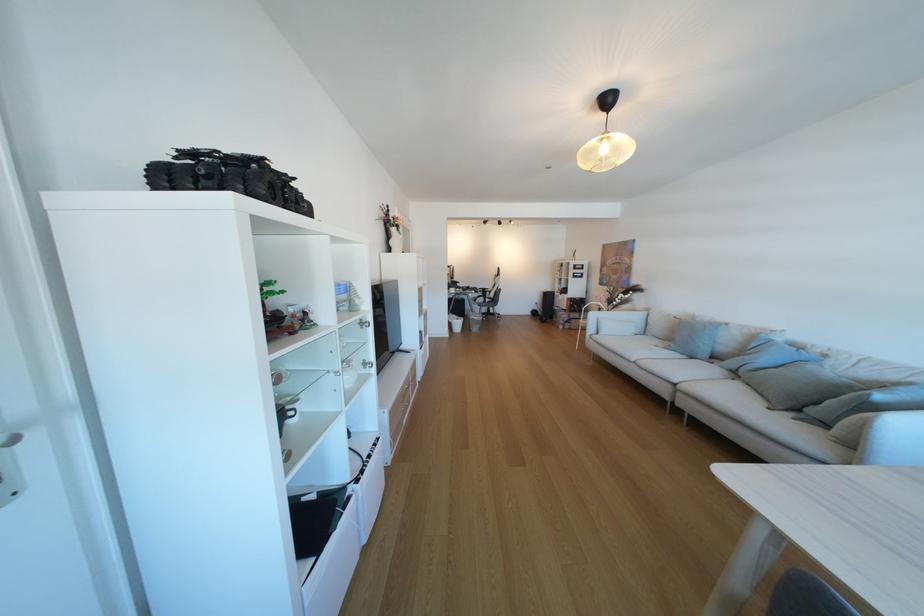
Where would you sit the sofa sitting surface? Please return your answer as a coordinate pair (x, y).

(743, 363)